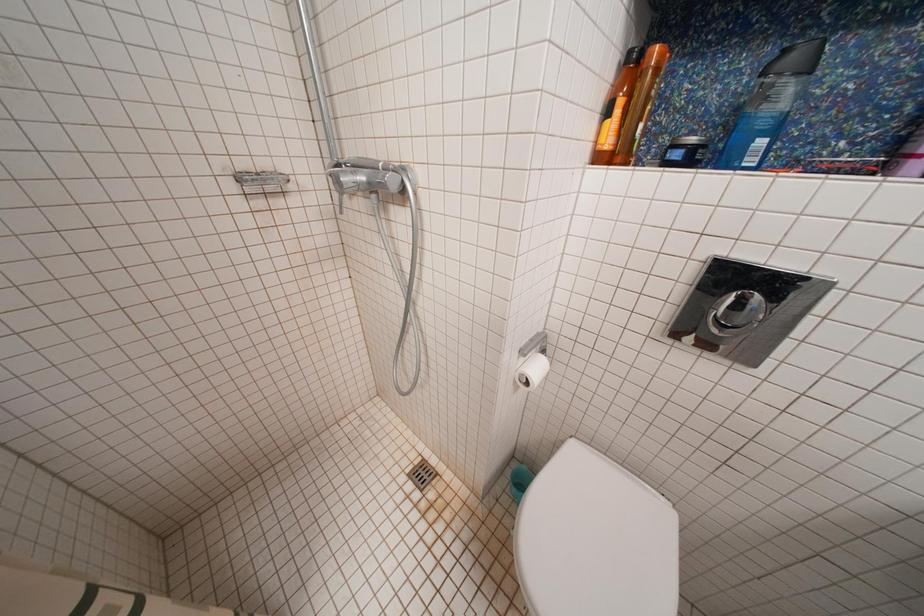
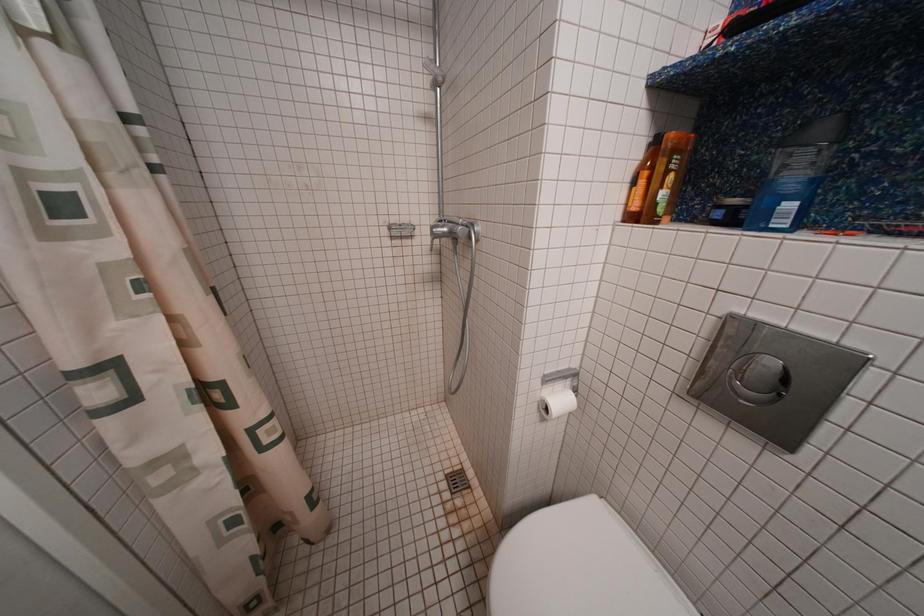
Which direction would the cameraman need to move to produce the second image?

The cameraman moved toward right, backward.